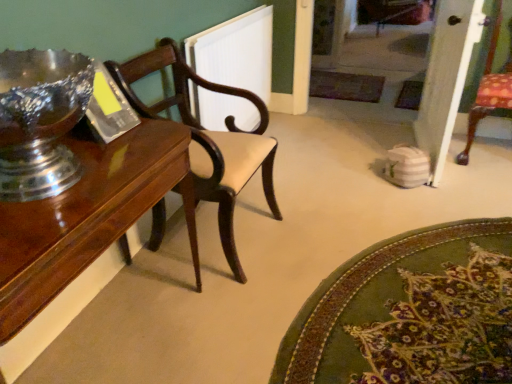
Question: Is shiny wood table at left far from white textured radiator at upper center?

Choices:
 (A) yes
 (B) no

Answer: (A)

Question: From a real-world perspective, is shiny wood table at left beneath white textured radiator at upper center?

Choices:
 (A) yes
 (B) no

Answer: (A)

Question: Is shiny wood table at left positioned beyond the bounds of white textured radiator at upper center?

Choices:
 (A) yes
 (B) no

Answer: (A)

Question: Does shiny wood table at left lie in front of white textured radiator at upper center?

Choices:
 (A) no
 (B) yes

Answer: (B)

Question: Can you confirm if shiny wood table at left is wider than white textured radiator at upper center?

Choices:
 (A) no
 (B) yes

Answer: (B)

Question: Is shiny wood table at left aimed at white textured radiator at upper center?

Choices:
 (A) no
 (B) yes

Answer: (A)

Question: Does mahogany wood chair at left turn towards white textured radiator at upper center?

Choices:
 (A) no
 (B) yes

Answer: (A)

Question: Are mahogany wood chair at left and white textured radiator at upper center far apart?

Choices:
 (A) yes
 (B) no

Answer: (B)

Question: Considering the relative sizes of mahogany wood chair at left and white textured radiator at upper center in the image provided, is mahogany wood chair at left shorter than white textured radiator at upper center?

Choices:
 (A) yes
 (B) no

Answer: (B)

Question: Considering the relative sizes of mahogany wood chair at left and white textured radiator at upper center in the image provided, is mahogany wood chair at left smaller than white textured radiator at upper center?

Choices:
 (A) no
 (B) yes

Answer: (A)

Question: From a real-world perspective, does mahogany wood chair at left stand above white textured radiator at upper center?

Choices:
 (A) no
 (B) yes

Answer: (B)

Question: Considering the relative sizes of mahogany wood chair at left and white textured radiator at upper center in the image provided, is mahogany wood chair at left bigger than white textured radiator at upper center?

Choices:
 (A) yes
 (B) no

Answer: (A)

Question: From a real-world perspective, is white textured radiator at upper center beneath green textured rug at lower right?

Choices:
 (A) no
 (B) yes

Answer: (A)